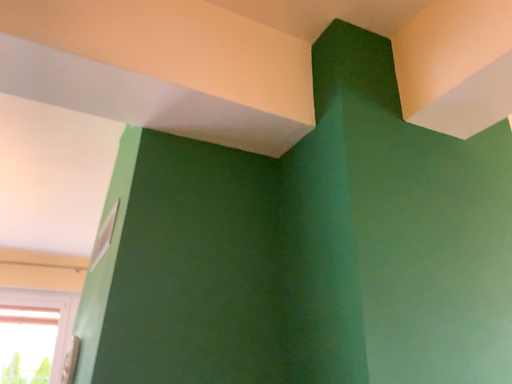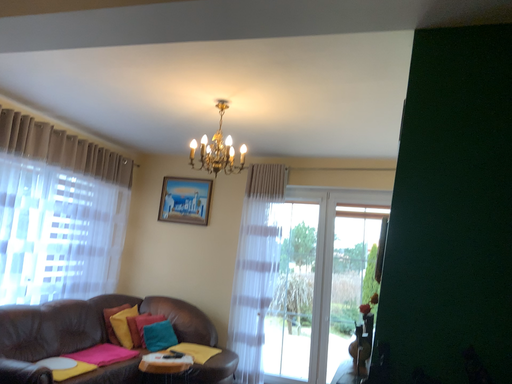
Question: How did the camera likely rotate when shooting the video?

Choices:
 (A) rotated downward
 (B) rotated upward

Answer: (A)